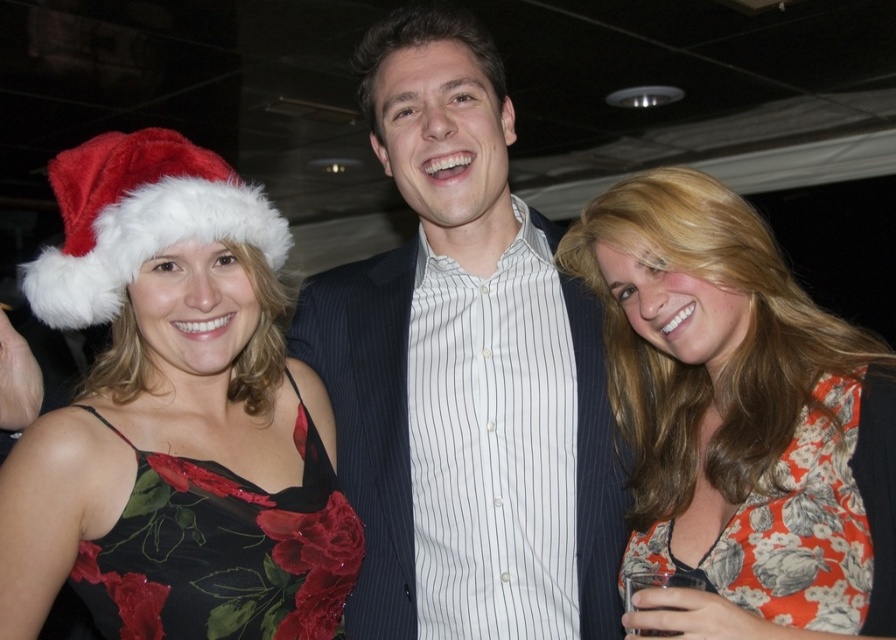
Question: Which of the following is the farthest from the observer?

Choices:
 (A) black satin dress at left
 (B) velvet floral dress at left

Answer: (A)

Question: Which of the following is the farthest from the observer?

Choices:
 (A) white striped shirt at center
 (B) black satin dress at left
 (C) velvet floral dress at left

Answer: (A)

Question: Is floral print fabric dress at right below fuzzy white santa hat at left?

Choices:
 (A) yes
 (B) no

Answer: (A)

Question: Which object is the closest to the velvet floral dress at left?

Choices:
 (A) floral-patterned dress at right
 (B) white striped shirt at center
 (C) fuzzy white santa hat at left

Answer: (C)

Question: Can you confirm if floral-patterned dress at right is thinner than black satin dress at left?

Choices:
 (A) yes
 (B) no

Answer: (B)

Question: Can you confirm if white striped shirt at center is positioned below floral-patterned dress at right?

Choices:
 (A) no
 (B) yes

Answer: (A)